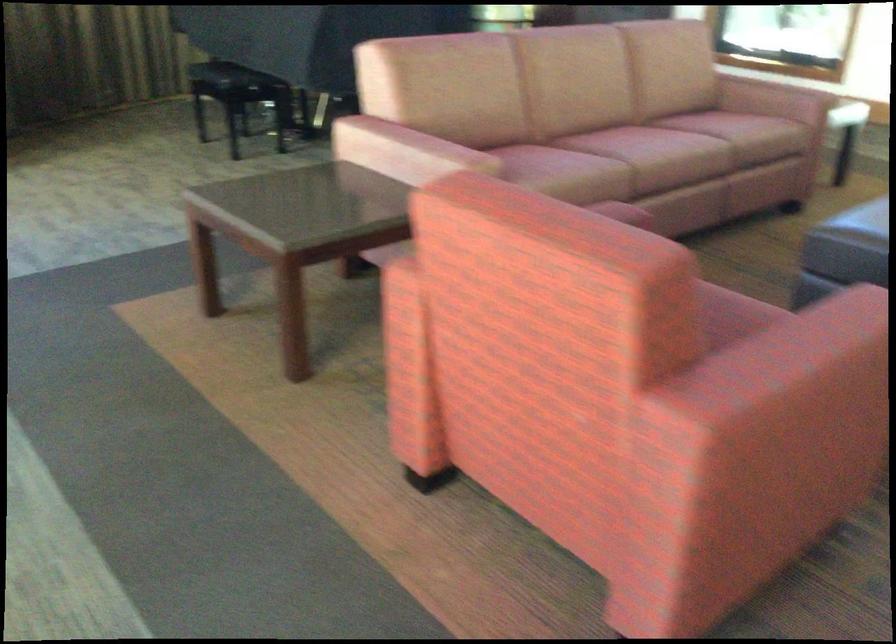
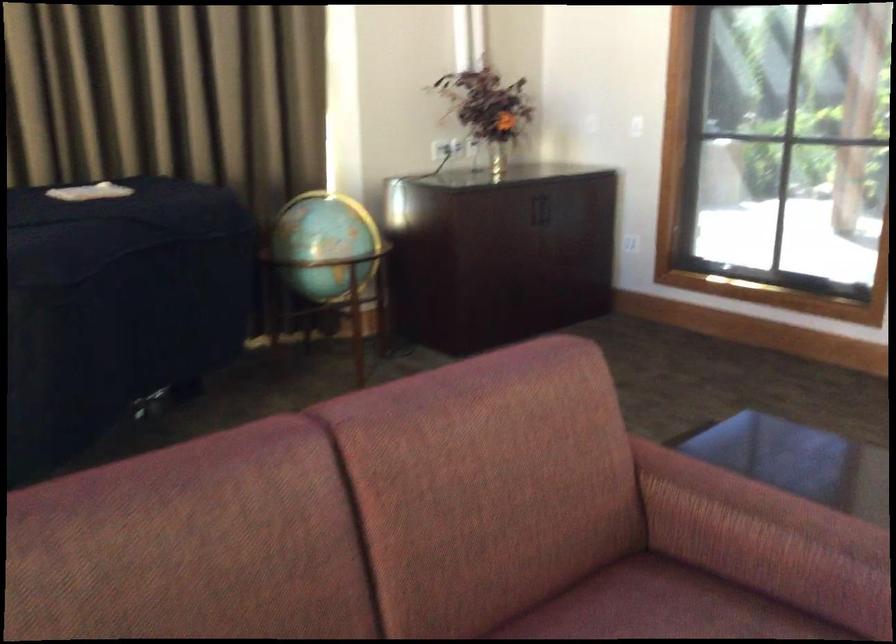
In a continuous first-person perspective shot, in which direction is the camera moving?

The cameraman moved toward right, forward.